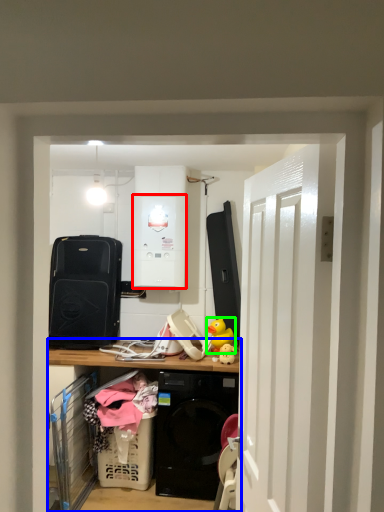
Question: Which is nearer to the appliance (highlighted by a red box)? cabinetry (highlighted by a blue box) or toy (highlighted by a green box).

Choices:
 (A) cabinetry
 (B) toy

Answer: (B)